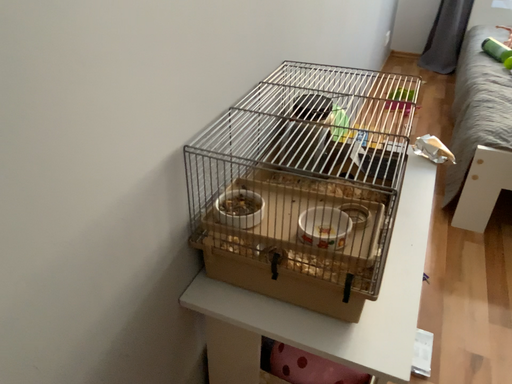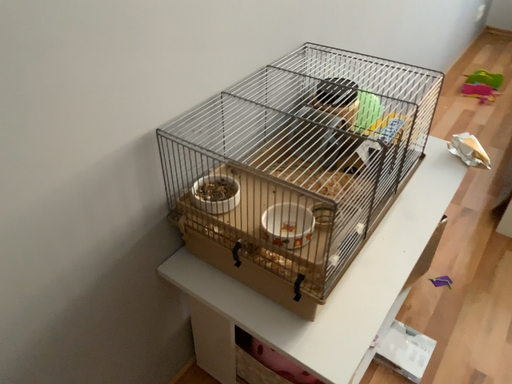
Question: How did the camera likely rotate when shooting the video?

Choices:
 (A) rotated right
 (B) rotated left

Answer: (B)